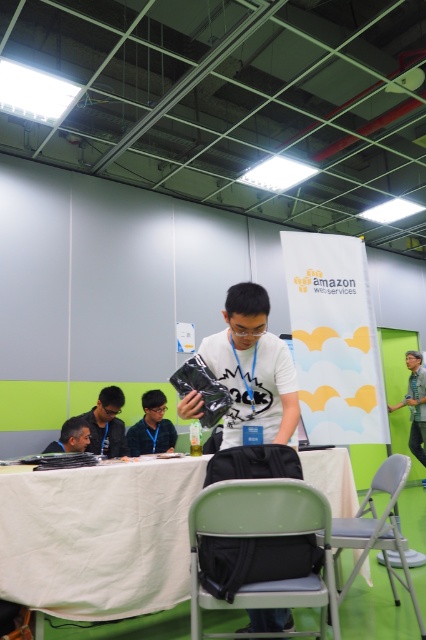
Does gray fabric chair at lower center lie in front of dark gray shirt at lower left?

Yes, it is in front of dark gray shirt at lower left.

Does gray fabric chair at lower center appear on the right side of dark gray shirt at lower left?

Correct, you'll find gray fabric chair at lower center to the right of dark gray shirt at lower left.

Locate an element on the screen. gray fabric chair at lower center is located at coordinates (377, 531).

You are a GUI agent. You are given a task and a screenshot of the screen. Output one action in this format:
    pyautogui.click(x=<x>, y=<y>)
    Task: Click on the gray fabric chair at lower center
    
    Given the screenshot: What is the action you would take?
    pyautogui.click(x=377, y=531)

Is green fabric chair at lower center smaller than green fabric shirt at right?

Correct, green fabric chair at lower center occupies less space than green fabric shirt at right.

Between point (316, 522) and point (411, 403), which one is positioned behind?

The point (411, 403) is behind.

Between point (218, 604) and point (409, 380), which one is positioned in front?

Point (218, 604) is in front.

Find the location of a particular element. Image resolution: width=426 pixels, height=640 pixels. green fabric chair at lower center is located at coordinates (265, 538).

Who is more distant from viewer, (152,506) or (423,632)?

Positioned behind is point (152,506).

Locate an element on the screen. white fabric table at center is located at coordinates tap(97, 538).